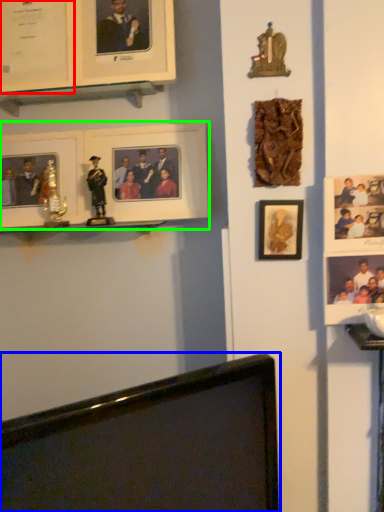
Question: Which is farther away from picture frame (highlighted by a red box)? computer monitor (highlighted by a blue box) or picture frame (highlighted by a green box)?

Choices:
 (A) computer monitor
 (B) picture frame

Answer: (A)